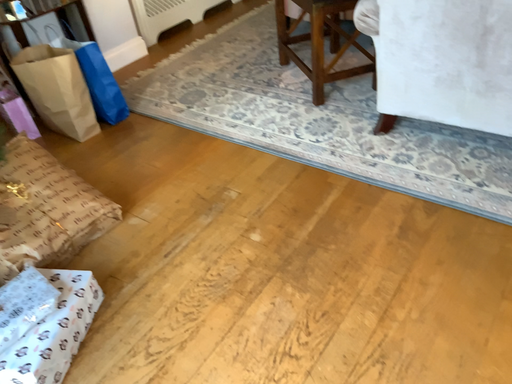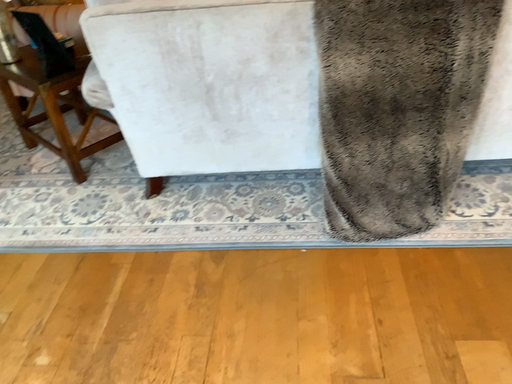
Question: How did the camera likely rotate when shooting the video?

Choices:
 (A) rotated downward
 (B) rotated upward

Answer: (B)